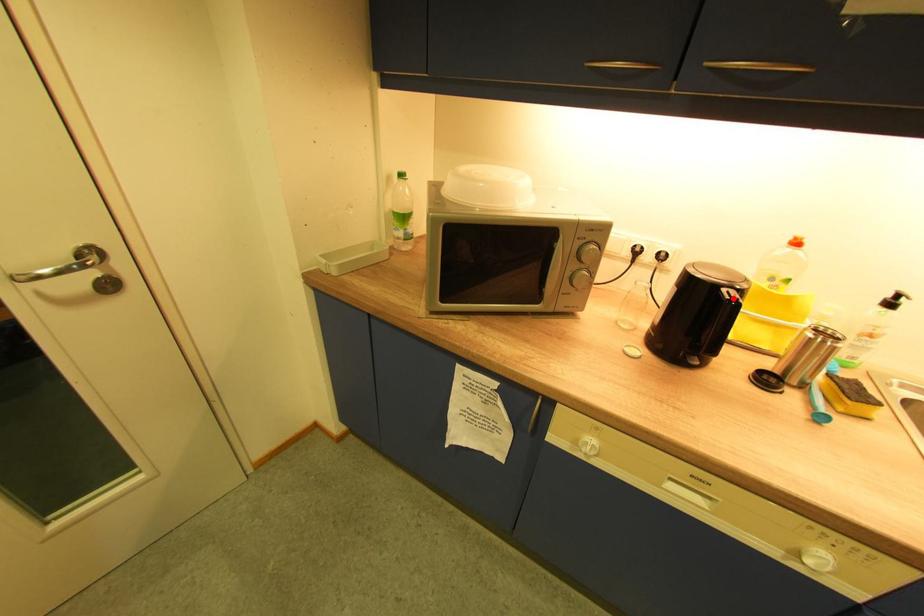
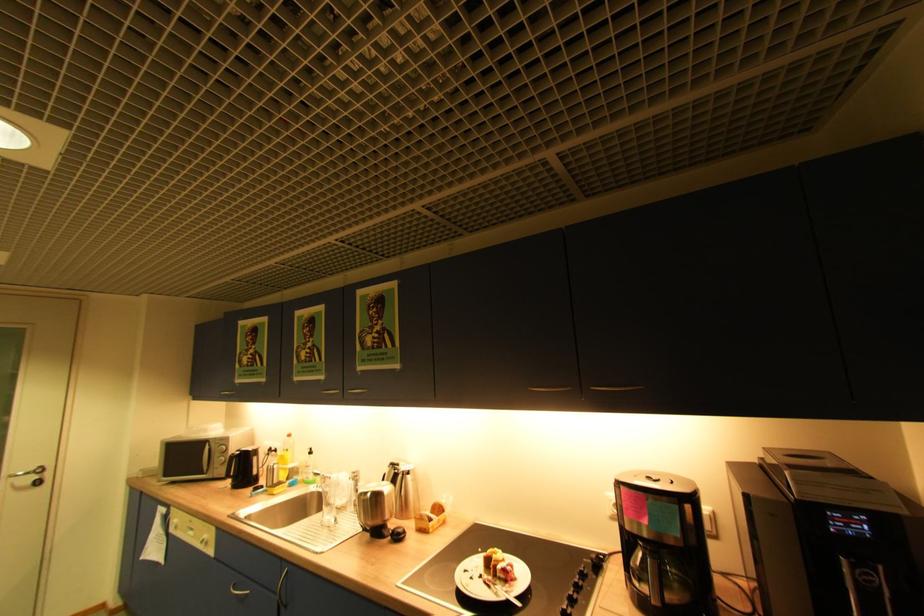
Question: I am providing you with two images of the same scene from different viewpoints. A red point is marked on the first image. At the location where the point appears in image 1, is it still visible in image 2?

Choices:
 (A) Yes
 (B) No

Answer: (B)